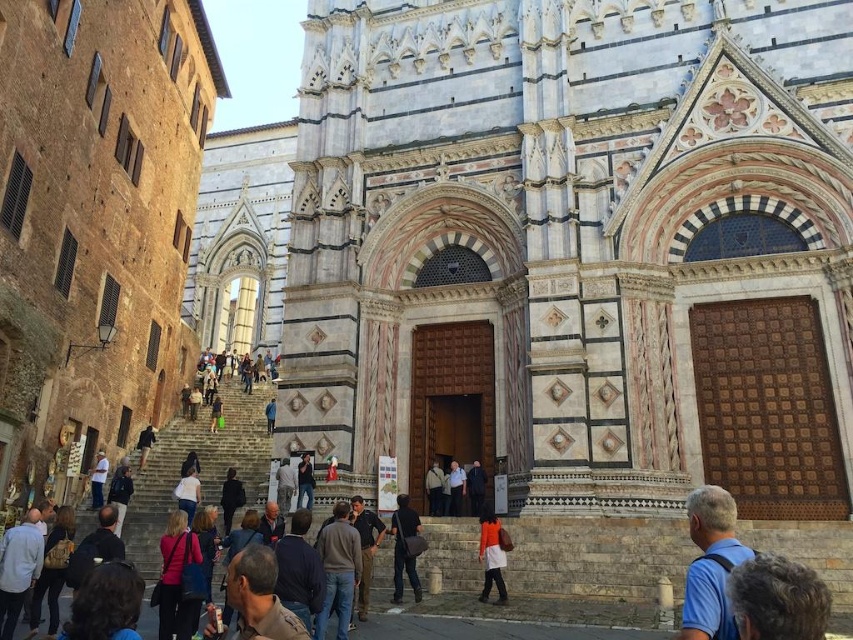
Question: Which point is farther to the camera?

Choices:
 (A) (393, 509)
 (B) (502, 531)
 (C) (166, 568)

Answer: (A)

Question: Considering the relative positions of pink fabric purse at lower left and orange fabric bag at center in the image provided, where is pink fabric purse at lower left located with respect to orange fabric bag at center?

Choices:
 (A) right
 (B) left

Answer: (B)

Question: Does gray stone stairs at center appear under pink fabric purse at lower left?

Choices:
 (A) no
 (B) yes

Answer: (A)

Question: Can you confirm if light brown leather backpack at lower left is smaller than dark brown leather backpack at center?

Choices:
 (A) no
 (B) yes

Answer: (A)

Question: Which object is farther from the camera taking this photo?

Choices:
 (A) brown leather jacket at center
 (B) orange fabric bag at center
 (C) dark brown hair at lower right
 (D) pink fabric purse at lower left

Answer: (B)

Question: Which point appears closest to the camera in this image?

Choices:
 (A) (316, 541)
 (B) (503, 602)

Answer: (A)